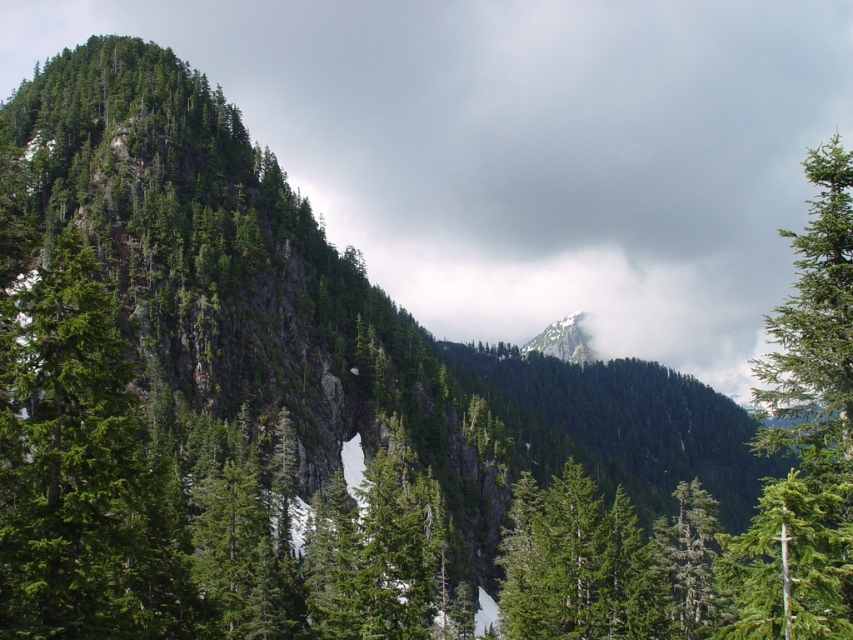
Question: Among these points, which one is nearest to the camera?

Choices:
 (A) (836, 579)
 (B) (566, 346)
 (C) (706, 557)

Answer: (A)

Question: Is green matte tree at right to the left of white snow-covered mountain at center from the viewer's perspective?

Choices:
 (A) no
 (B) yes

Answer: (A)

Question: Is green matte tree at center bigger than white snow-covered mountain at center?

Choices:
 (A) no
 (B) yes

Answer: (B)

Question: Which point is closer to the camera?

Choices:
 (A) (573, 340)
 (B) (599, 268)

Answer: (A)

Question: Can you confirm if green matte tree at right is positioned to the left of green matte tree at center?

Choices:
 (A) yes
 (B) no

Answer: (B)

Question: Which object appears closest to the camera in this image?

Choices:
 (A) green matte tree at right
 (B) white snow-covered mountain at center
 (C) white fluffy cloud at upper center
 (D) green matte tree at center

Answer: (A)